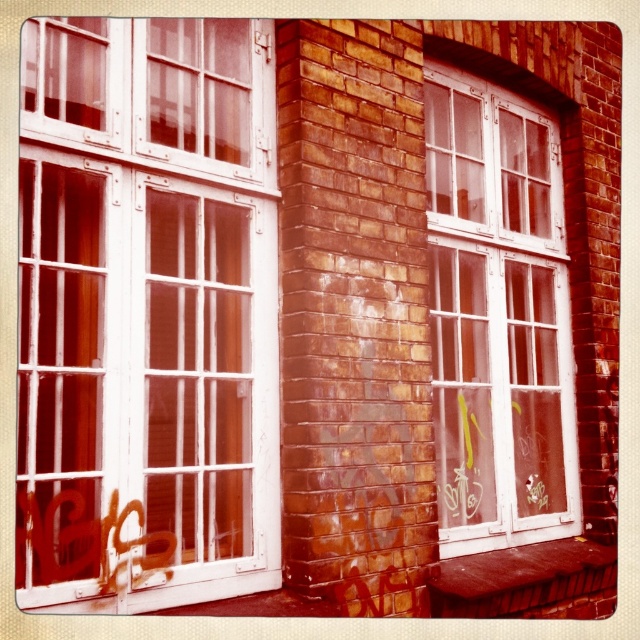
Where is `white glass window at right`? white glass window at right is located at coordinates (497, 317).

From the picture: Is white glass window at right positioned at the back of brown wooden bench at lower right?

Yes, it is.

In the scene shown: Who is more forward, (550, 253) or (602, 557)?

Point (602, 557) is more forward.

At what (x,y) coordinates should I click in order to perform the action: click on white glass window at right. Please return your answer as a coordinate pair (x, y). The width and height of the screenshot is (640, 640). Looking at the image, I should click on (497, 317).

In the scene shown: Does white painted wood window frame at left have a lesser width compared to white glass window at right?

Indeed, white painted wood window frame at left has a lesser width compared to white glass window at right.

Can you confirm if white painted wood window frame at left is positioned to the left of white glass window at right?

Yes, white painted wood window frame at left is to the left of white glass window at right.

Describe the element at coordinates (147, 312) in the screenshot. The width and height of the screenshot is (640, 640). I see `white painted wood window frame at left` at that location.

The height and width of the screenshot is (640, 640). I want to click on white painted wood window frame at left, so click(147, 312).

Which of these two, white painted wood window frame at left or brown wooden bench at lower right, stands shorter?

brown wooden bench at lower right

Is white painted wood window frame at left taller than brown wooden bench at lower right?

Indeed, white painted wood window frame at left has a greater height compared to brown wooden bench at lower right.

Between point (77, 445) and point (513, 611), which one is positioned in front?

Point (77, 445) is in front.

Locate an element on the screen. The width and height of the screenshot is (640, 640). white painted wood window frame at left is located at coordinates (147, 312).